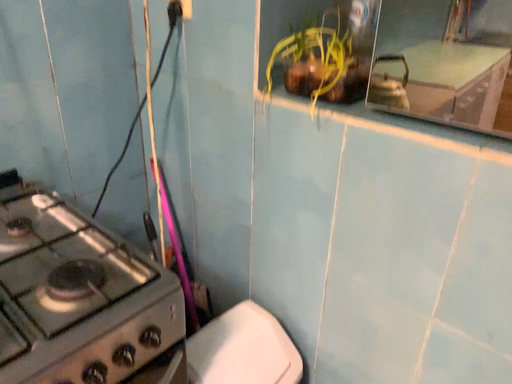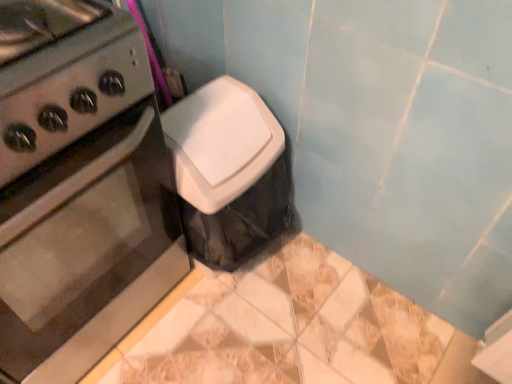
Question: Which way did the camera rotate in the video?

Choices:
 (A) rotated upward
 (B) rotated downward

Answer: (B)